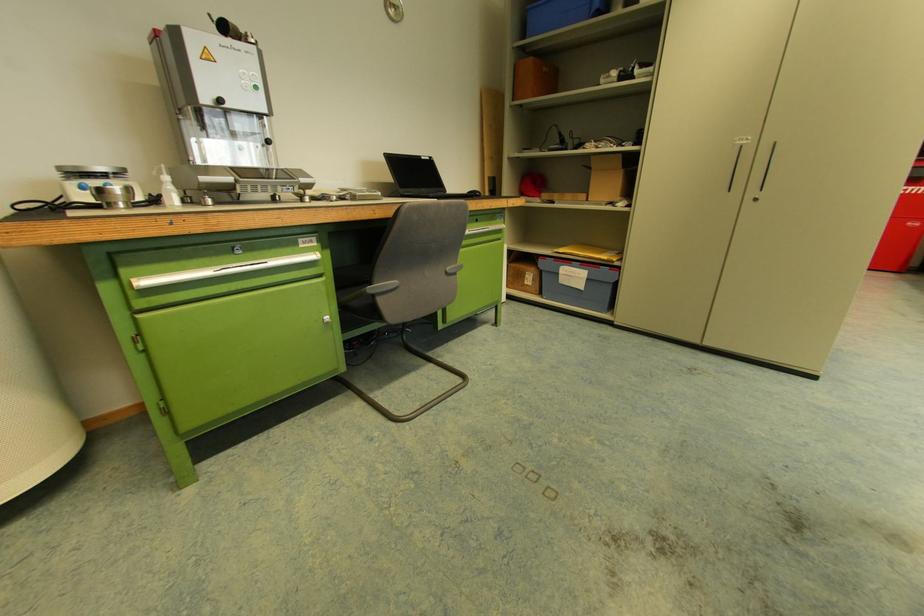
The width and height of the screenshot is (924, 616). Find the location of `computer mouse`. computer mouse is located at coordinates (477, 198).